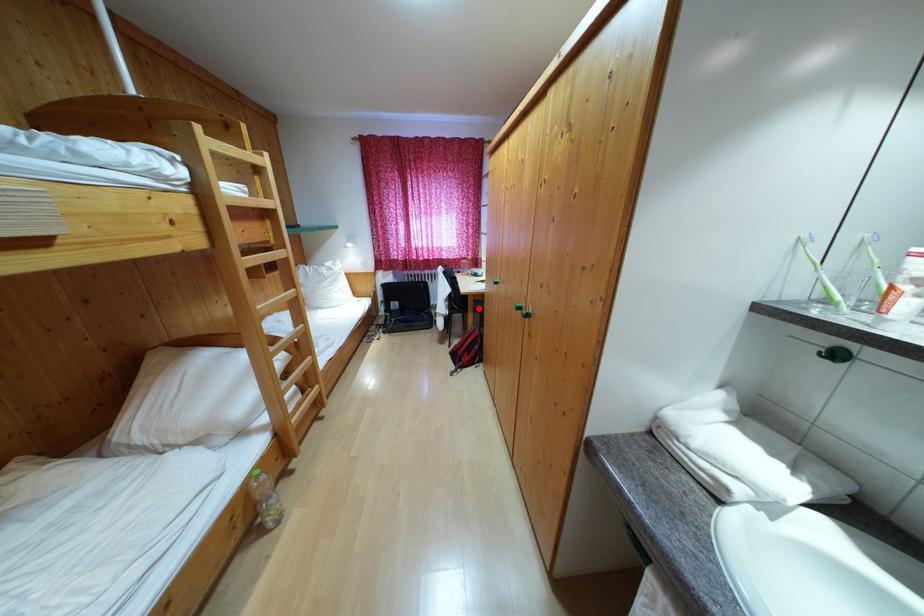
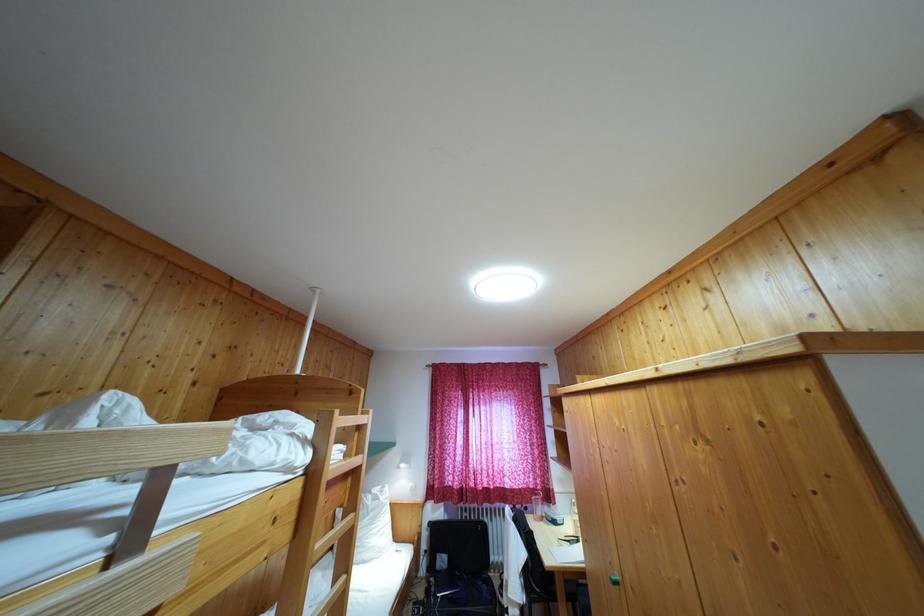
Find the pixel in the second image that matches the highlighted location in the first image.

(569, 589)